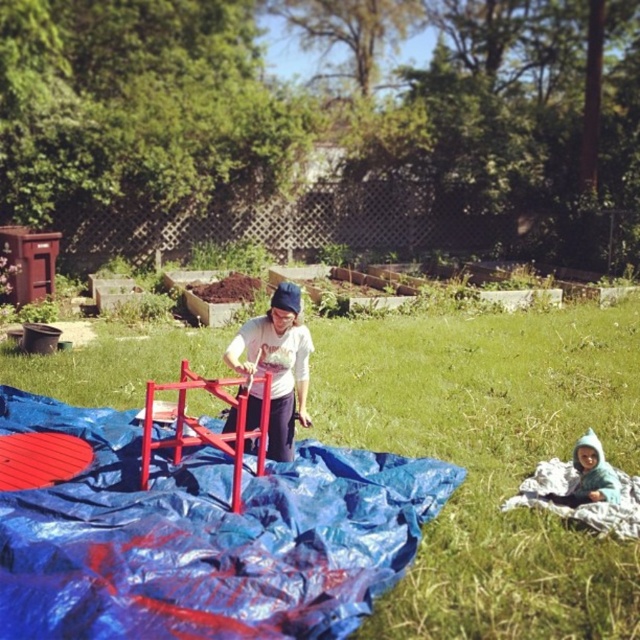
You are planning to set up a picnic blanket in the backyard scene. Given the presence of the green grass at center and the metallic red ladder at center, which object would allow more space for the blanket?

The green grass at center has a larger size compared to the metallic red ladder at center, so it would provide more space for the picnic blanket.

You are a photographer setting up a tripod in the backyard. You want to place the tripod on the green grass at center without blocking the blue fleece jacket at lower right. Is there enough space between them to do this?

The green grass at center is to the left of the blue fleece jacket at lower right, so placing the tripod on the green grass at center should be possible without blocking the blue fleece jacket at lower right as they are positioned side by side horizontally.

What is the 2D coordinate of the green grass at center?

The green grass at center is located at the 2D coordinate point of [493,460].